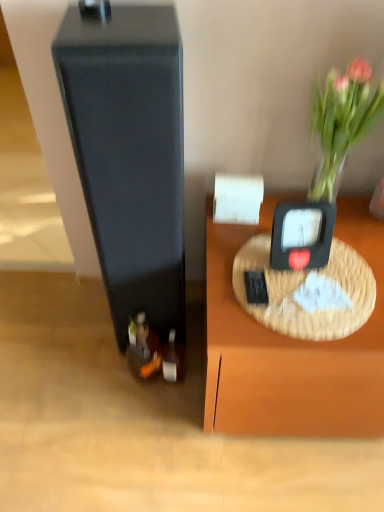
You are a GUI agent. You are given a task and a screenshot of the screen. Output one action in this format:
    pyautogui.click(x=<x>, y=<y>)
    Task: Click on the vacant space behind shiny silver wine bottle at lower center, marked as the 1th wine bottle in a right-to-left arrangement
    This screenshot has height=512, width=384.
    Given the screenshot: What is the action you would take?
    pyautogui.click(x=193, y=348)